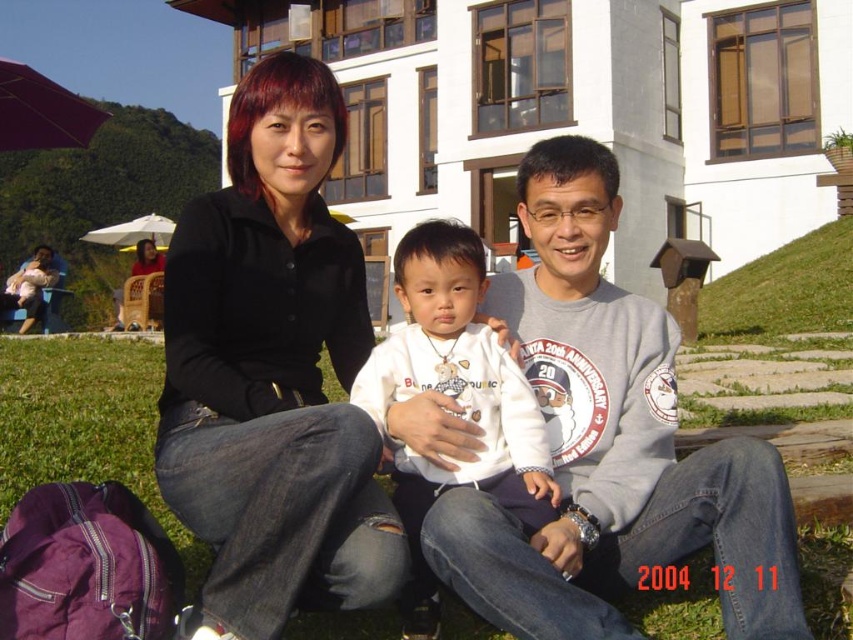
Does black matte shirt at center appear over gray cotton sweatshirt at center?

Indeed, black matte shirt at center is positioned over gray cotton sweatshirt at center.

Which of these two, black matte shirt at center or gray cotton sweatshirt at center, stands shorter?

gray cotton sweatshirt at center is shorter.

Who is more forward, (345, 109) or (625, 435)?

Point (625, 435)

Where is `black matte shirt at center`? black matte shirt at center is located at coordinates (273, 372).

Is gray cotton sweatshirt at center below white fleece jacket at center?

Incorrect, gray cotton sweatshirt at center is not positioned below white fleece jacket at center.

Does gray cotton sweatshirt at center have a larger size compared to white fleece jacket at center?

Indeed, gray cotton sweatshirt at center has a larger size compared to white fleece jacket at center.

Does point (462, 522) lie in front of point (514, 424)?

That is True.

You are a GUI agent. You are given a task and a screenshot of the screen. Output one action in this format:
    pyautogui.click(x=<x>, y=<y>)
    Task: Click on the gray cotton sweatshirt at center
    The height and width of the screenshot is (640, 853).
    Given the screenshot: What is the action you would take?
    pyautogui.click(x=608, y=444)

Does black matte shirt at center have a smaller size compared to white fleece jacket at center?

Actually, black matte shirt at center might be larger than white fleece jacket at center.

Is black matte shirt at center behind white fleece jacket at center?

No.

Where is `black matte shirt at center`? black matte shirt at center is located at coordinates (273, 372).